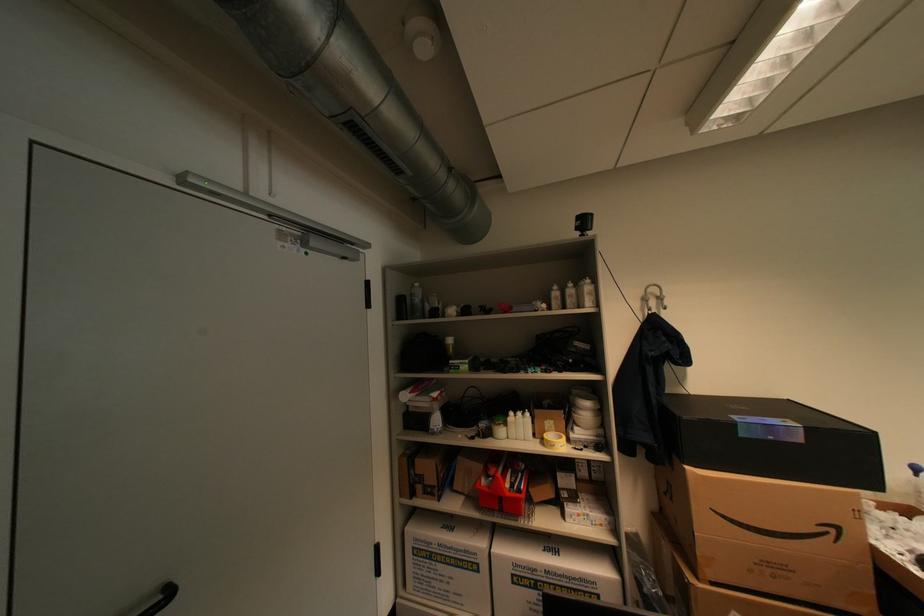
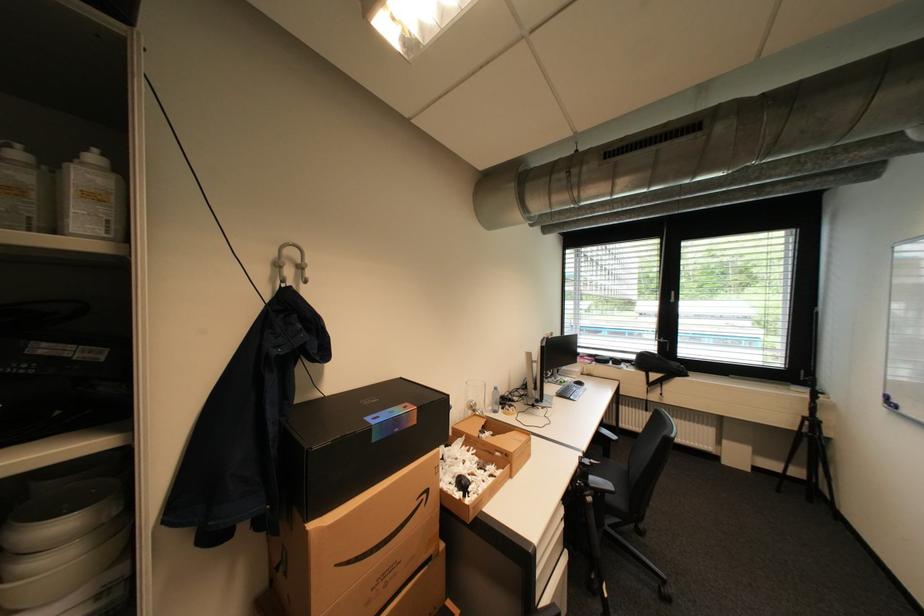
Locate, in the second image, the point that corresponds to [673,339] in the first image.

(309, 326)